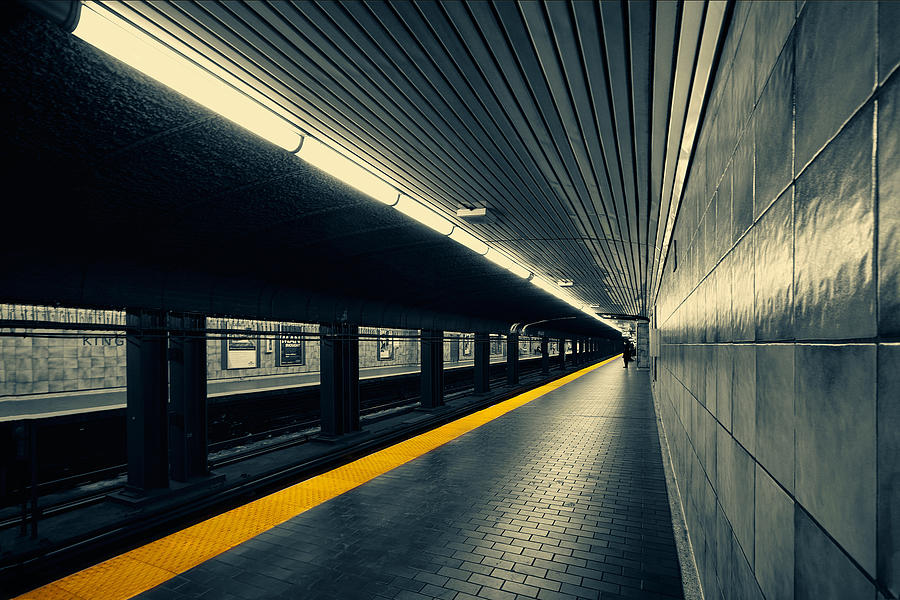
Identify the location of black tiled floor. This screenshot has height=600, width=900. (590, 455), (627, 383), (420, 555).